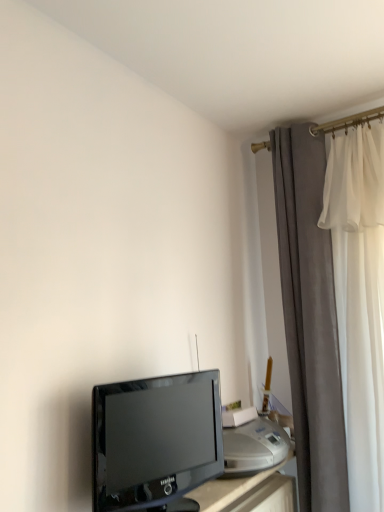
Find the location of a particular element. black glossy television at lower left is located at coordinates (155, 439).

Which of these two, black glossy television at lower left or satin silver printer at lower right, stands shorter?

satin silver printer at lower right is shorter.

Who is smaller, black glossy television at lower left or satin silver printer at lower right?

satin silver printer at lower right is smaller.

Consider the image. Is black glossy television at lower left not inside satin silver printer at lower right?

Yes.

Is black glossy television at lower left turned away from satin silver printer at lower right?

No, satin silver printer at lower right is not at the back of black glossy television at lower left.

Can you confirm if black glossy television at lower left is bigger than velvet gray curtain at right?

Incorrect, black glossy television at lower left is not larger than velvet gray curtain at right.

Which of these two, black glossy television at lower left or velvet gray curtain at right, is wider?

With larger width is velvet gray curtain at right.

This screenshot has width=384, height=512. I want to click on curtain to the right of black glossy television at lower left, so click(310, 319).

Which object is positioned more to the right, satin silver printer at lower right or black glossy television at lower left?

Positioned to the right is satin silver printer at lower right.

Which object is closer to the camera, satin silver printer at lower right or black glossy television at lower left?

black glossy television at lower left is closer to the camera.

Is satin silver printer at lower right turned away from black glossy television at lower left?

satin silver printer at lower right does not have its back to black glossy television at lower left.

Is satin silver printer at lower right bigger than black glossy television at lower left?

Actually, satin silver printer at lower right might be smaller than black glossy television at lower left.

Is velvet gray curtain at right located within satin silver printer at lower right?

No, velvet gray curtain at right is located outside of satin silver printer at lower right.

Is velvet gray curtain at right at the back of satin silver printer at lower right?

No, satin silver printer at lower right is not facing away from velvet gray curtain at right.

Are velvet gray curtain at right and black glossy television at lower left far apart?

They are positioned close to each other.

Consider the image. Considering the positions of objects velvet gray curtain at right and black glossy television at lower left in the image provided, who is more to the left, velvet gray curtain at right or black glossy television at lower left?

Positioned to the left is black glossy television at lower left.

Consider the image. From the image's perspective, who appears lower, velvet gray curtain at right or black glossy television at lower left?

black glossy television at lower left.

Is velvet gray curtain at right wider or thinner than black glossy television at lower left?

In the image, velvet gray curtain at right appears to be wider than black glossy television at lower left.

Based on the photo, is velvet gray curtain at right not near satin silver printer at lower right?

That's not correct — velvet gray curtain at right is a little close to satin silver printer at lower right.

From the image's perspective, would you say velvet gray curtain at right is shown under satin silver printer at lower right?

Actually, velvet gray curtain at right appears above satin silver printer at lower right in the image.

Can satin silver printer at lower right be found inside velvet gray curtain at right?

Definitely not — satin silver printer at lower right is not inside velvet gray curtain at right.

Between velvet gray curtain at right and satin silver printer at lower right, which one has larger width?

With larger width is velvet gray curtain at right.

Find the location of a particular element. The width and height of the screenshot is (384, 512). printer on the right of black glossy television at lower left is located at coordinates (253, 447).

Identify the location of television in front of the velvet gray curtain at right. (155, 439).

Based on their spatial positions, is satin silver printer at lower right or black glossy television at lower left closer to velvet gray curtain at right?

satin silver printer at lower right is closer to velvet gray curtain at right.

Which object lies nearer to the anchor point satin silver printer at lower right, black glossy television at lower left or velvet gray curtain at right?

black glossy television at lower left is positioned closer to the anchor satin silver printer at lower right.

Considering their positions, is velvet gray curtain at right positioned further to black glossy television at lower left than satin silver printer at lower right?

Among the two, velvet gray curtain at right is located further to black glossy television at lower left.

Considering their positions, is satin silver printer at lower right positioned closer to black glossy television at lower left than velvet gray curtain at right?

The object closer to black glossy television at lower left is satin silver printer at lower right.

Estimate the real-world distances between objects in this image. Which object is further from velvet gray curtain at right, black glossy television at lower left or satin silver printer at lower right?

Among the two, black glossy television at lower left is located further to velvet gray curtain at right.

Based on their spatial positions, is velvet gray curtain at right or black glossy television at lower left closer to satin silver printer at lower right?

The object closer to satin silver printer at lower right is black glossy television at lower left.

Find the location of `printer located between black glossy television at lower left and velvet gray curtain at right in the left-right direction`. printer located between black glossy television at lower left and velvet gray curtain at right in the left-right direction is located at coordinates (253, 447).